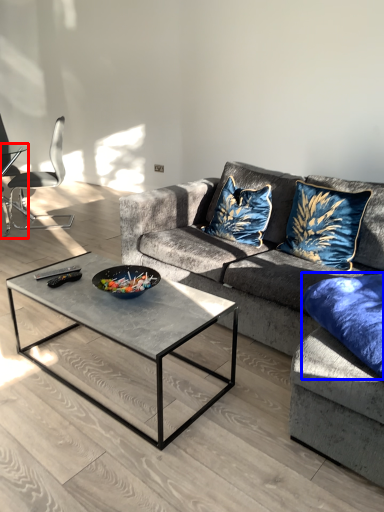
Question: Which of the following is the farthest to the observer, coffee table (highlighted by a red box) or pillow (highlighted by a blue box)?

Choices:
 (A) coffee table
 (B) pillow

Answer: (A)